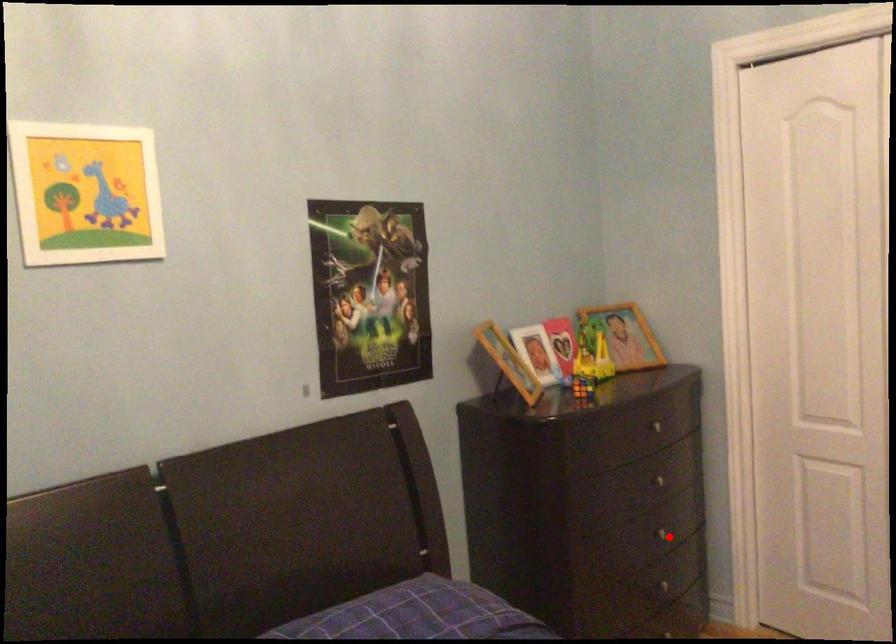
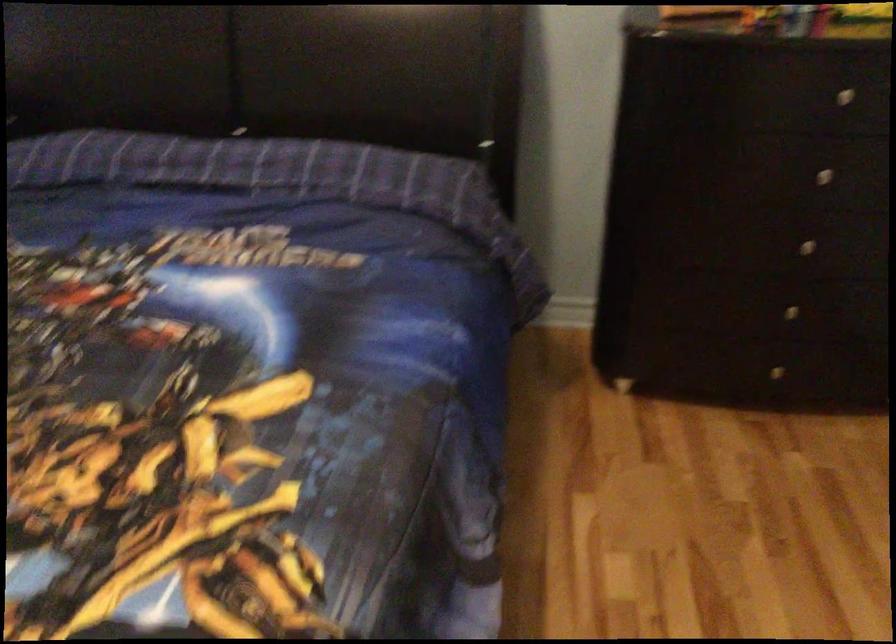
Locate, in the second image, the point that corresponds to the highlighted location in the first image.

(805, 245)